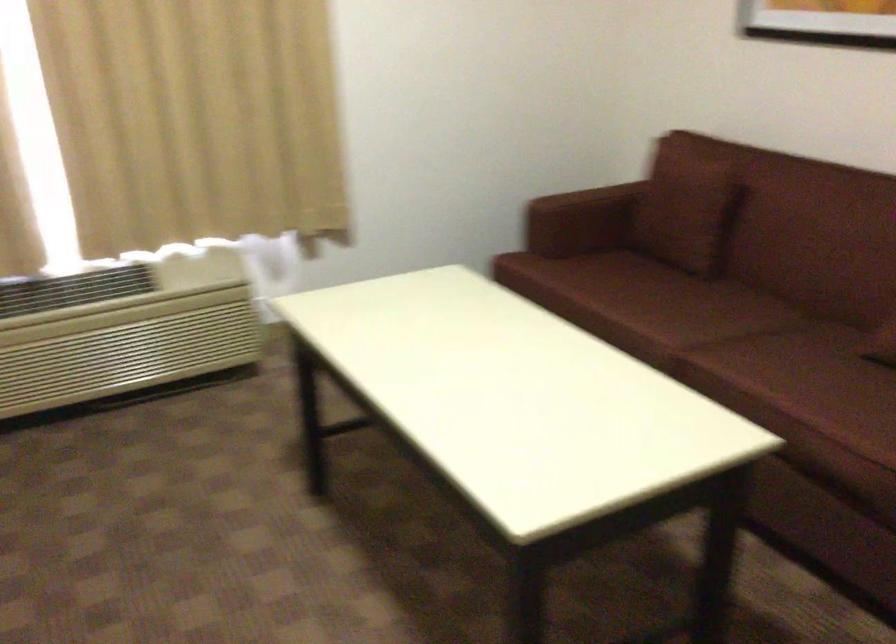
This screenshot has width=896, height=644. Describe the element at coordinates (573, 225) in the screenshot. I see `the red sofa armrest` at that location.